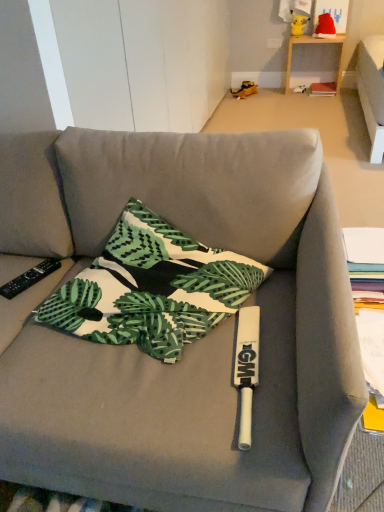
What is the approximate height of yellow plush toy at upper center, the 1th toy when ordered from left to right?

The height of yellow plush toy at upper center, the 1th toy when ordered from left to right, is 8.71 inches.

What are the coordinates of `yellow plush toy at upper center, the 1th toy when ordered from left to right` in the screenshot? It's located at (299, 22).

How much space does red fabric santa hat at upper right, the 2th toy in the left-to-right sequence, occupy vertically?

The height of red fabric santa hat at upper right, the 2th toy in the left-to-right sequence, is 8.20 inches.

What do you see at coordinates (325, 27) in the screenshot? The height and width of the screenshot is (512, 384). I see `red fabric santa hat at upper right, the 2th toy in the left-to-right sequence` at bounding box center [325, 27].

I want to click on black plastic remote control at left, so (29, 278).

Locate an element on the screen. The width and height of the screenshot is (384, 512). hardcover book at center is located at coordinates (323, 89).

Between green leaf-patterned fabric pillow at center and black plastic remote control at left, which one has more height?

Standing taller between the two is green leaf-patterned fabric pillow at center.

From a real-world perspective, which object stands above the other?

green leaf-patterned fabric pillow at center is physically above.

The width and height of the screenshot is (384, 512). Identify the location of pillow located below the black plastic remote control at left (from the image's perspective). (152, 288).

Which is in front, green leaf-patterned fabric pillow at center or black plastic remote control at left?

Positioned in front is green leaf-patterned fabric pillow at center.

Is hardcover book at center at the back of red fabric santa hat at upper right, the 2th toy in the left-to-right sequence?

red fabric santa hat at upper right, the 2th toy in the left-to-right sequence, does not have its back to hardcover book at center.

Is red fabric santa hat at upper right, the 2th toy in the left-to-right sequence, taller or shorter than hardcover book at center?

red fabric santa hat at upper right, the 2th toy in the left-to-right sequence, is taller than hardcover book at center.

Considering the positions of point (319, 24) and point (333, 85), is point (319, 24) closer or farther from the camera than point (333, 85)?

Point (319, 24) appears to be closer to the viewer than point (333, 85).

What's the angular difference between yellow plush toy at upper center, the 1th toy when ordered from left to right, and hardcover book at center's facing directions?

yellow plush toy at upper center, the 1th toy when ordered from left to right, and hardcover book at center are facing 3.14 degrees away from each other.

Is yellow plush toy at upper center, marked as the 2th toy in a right-to-left arrangement, aimed at hardcover book at center?

No, yellow plush toy at upper center, marked as the 2th toy in a right-to-left arrangement, is not oriented towards hardcover book at center.

Can we say yellow plush toy at upper center, the 1th toy when ordered from left to right, lies outside hardcover book at center?

Yes, yellow plush toy at upper center, the 1th toy when ordered from left to right, is located beyond the bounds of hardcover book at center.

Between yellow plush toy at upper center, marked as the 2th toy in a right-to-left arrangement, and hardcover book at center, which one appears on the left side from the viewer's perspective?

yellow plush toy at upper center, marked as the 2th toy in a right-to-left arrangement.

Is black plastic remote control at left located within red fabric santa hat at upper right, the 2th toy in the left-to-right sequence?

No, red fabric santa hat at upper right, the 2th toy in the left-to-right sequence, does not contain black plastic remote control at left.

Considering the relative positions of red fabric santa hat at upper right, placed as the first toy when sorted from right to left, and black plastic remote control at left in the image provided, is red fabric santa hat at upper right, placed as the first toy when sorted from right to left, to the left or to the right of black plastic remote control at left?

Clearly, red fabric santa hat at upper right, placed as the first toy when sorted from right to left, is on the right of black plastic remote control at left in the image.

From the image's perspective, relative to black plastic remote control at left, is red fabric santa hat at upper right, the 2th toy in the left-to-right sequence, above or below?

From the image's perspective, red fabric santa hat at upper right, the 2th toy in the left-to-right sequence, appears above black plastic remote control at left.

In terms of height, does red fabric santa hat at upper right, the 2th toy in the left-to-right sequence, look taller or shorter compared to black plastic remote control at left?

Clearly, red fabric santa hat at upper right, the 2th toy in the left-to-right sequence, is taller compared to black plastic remote control at left.

How many degrees apart are the facing directions of red fabric santa hat at upper right, the 2th toy in the left-to-right sequence, and yellow plush toy at upper center, marked as the 2th toy in a right-to-left arrangement?

The angular difference between red fabric santa hat at upper right, the 2th toy in the left-to-right sequence, and yellow plush toy at upper center, marked as the 2th toy in a right-to-left arrangement, is 0.00143 degrees.

Which is closer to the camera, (319, 17) or (302, 17)?

Point (319, 17).

Is the position of red fabric santa hat at upper right, the 2th toy in the left-to-right sequence, less distant than that of yellow plush toy at upper center, marked as the 2th toy in a right-to-left arrangement?

Yes, it is in front of yellow plush toy at upper center, marked as the 2th toy in a right-to-left arrangement.

In the image, there is a red fabric santa hat at upper right, placed as the first toy when sorted from right to left. Identify the location of toy above it (from the image's perspective). (299, 22).

Does black plastic remote control at left touch yellow plush toy at upper center, the 1th toy when ordered from left to right?

No, black plastic remote control at left is not in contact with yellow plush toy at upper center, the 1th toy when ordered from left to right.

Which object is thinner, black plastic remote control at left or yellow plush toy at upper center, the 1th toy when ordered from left to right?

Thinner between the two is yellow plush toy at upper center, the 1th toy when ordered from left to right.

Which is more to the right, black plastic remote control at left or yellow plush toy at upper center, marked as the 2th toy in a right-to-left arrangement?

yellow plush toy at upper center, marked as the 2th toy in a right-to-left arrangement, is more to the right.

This screenshot has height=512, width=384. Find the location of `paperback book lying on the right of green leaf-patterned fabric pillow at center`. paperback book lying on the right of green leaf-patterned fabric pillow at center is located at coordinates (323, 89).

From the image's perspective, is green leaf-patterned fabric pillow at center on top of hardcover book at center?

No.

Which is behind, green leaf-patterned fabric pillow at center or hardcover book at center?

hardcover book at center is behind.

Identify the location of pillow lying in front of the black plastic remote control at left. This screenshot has height=512, width=384. (152, 288).

Find the location of a particular element. paperback book below the red fabric santa hat at upper right, placed as the first toy when sorted from right to left (from a real-world perspective) is located at coordinates (323, 89).

Estimate the real-world distances between objects in this image. Which object is closer to hardcover book at center, black plastic remote control at left or green leaf-patterned fabric pillow at center?

green leaf-patterned fabric pillow at center is positioned closer to the anchor hardcover book at center.

Looking at this image, based on their spatial positions, is hardcover book at center or green leaf-patterned fabric pillow at center closer to black plastic remote control at left?

Among the two, green leaf-patterned fabric pillow at center is located nearer to black plastic remote control at left.

Estimate the real-world distances between objects in this image. Which object is further from green leaf-patterned fabric pillow at center, red fabric santa hat at upper right, placed as the first toy when sorted from right to left, or wooden table at upper right?

Among the two, red fabric santa hat at upper right, placed as the first toy when sorted from right to left, is located further to green leaf-patterned fabric pillow at center.

Which object lies further to the anchor point yellow plush toy at upper center, the 1th toy when ordered from left to right, black plastic remote control at left or hardcover book at center?

black plastic remote control at left.

Looking at this image, based on their spatial positions, is yellow plush toy at upper center, the 1th toy when ordered from left to right, or black plastic remote control at left closer to wooden table at upper right?

The object closer to wooden table at upper right is yellow plush toy at upper center, the 1th toy when ordered from left to right.

Looking at the image, which one is located closer to wooden table at upper right, black plastic remote control at left or yellow plush toy at upper center, marked as the 2th toy in a right-to-left arrangement?

yellow plush toy at upper center, marked as the 2th toy in a right-to-left arrangement, is closer to wooden table at upper right.

Considering their positions, is wooden table at upper right positioned closer to hardcover book at center than red fabric santa hat at upper right, the 2th toy in the left-to-right sequence?

Among the two, wooden table at upper right is located nearer to hardcover book at center.

Estimate the real-world distances between objects in this image. Which object is closer to black plastic remote control at left, yellow plush toy at upper center, marked as the 2th toy in a right-to-left arrangement, or hardcover book at center?

hardcover book at center.

Where is `table between yellow plush toy at upper center, marked as the 2th toy in a right-to-left arrangement, and hardcover book at center vertically`? The image size is (384, 512). table between yellow plush toy at upper center, marked as the 2th toy in a right-to-left arrangement, and hardcover book at center vertically is located at coordinates (314, 42).

What are the coordinates of `table located between black plastic remote control at left and yellow plush toy at upper center, marked as the 2th toy in a right-to-left arrangement, in the depth direction` in the screenshot? It's located at (314, 42).

I want to click on toy that lies between yellow plush toy at upper center, the 1th toy when ordered from left to right, and hardcover book at center from top to bottom, so click(325, 27).

Identify the location of toy between black plastic remote control at left and wooden table at upper right in the front-back direction. (325, 27).